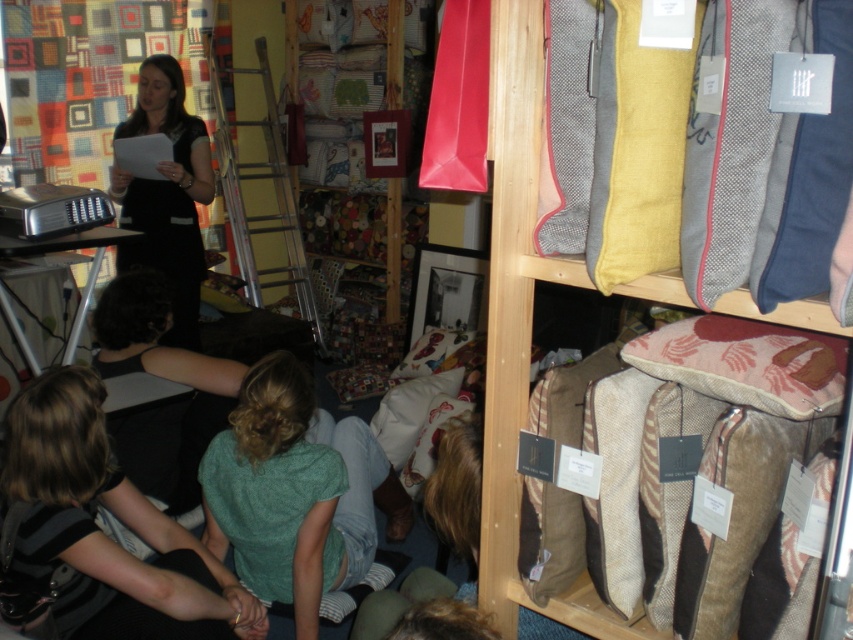
You are organizing a small exhibition and need to decide which item to place on a shelf that can only accommodate one of the two items. Given the green cotton shirt at lower center and the pink fabric pillow at lower right, which item would you choose based on their sizes?

The green cotton shirt at lower center has a larger size compared to the pink fabric pillow at lower right, so you should choose the green cotton shirt at lower center to place on the shelf since it requires more space.

You are organizing a small exhibition and need to decide which item to place in a display case that can only accommodate items taking up minimal space. Based on the scene, which item between the textured woolen cushion at upper right and the green cotton shirt at lower center should you choose?

The textured woolen cushion at upper right should be chosen because it occupies less space than the green cotton shirt at lower center, making it suitable for the display case with limited space.

You are a customer at the craft fair and want to approach the vendor. Which object, the blonde hair at lower left or the green cotton shirt at lower center, is narrower so you can navigate around them more easily?

The blonde hair at lower left has a lesser width compared to the green cotton shirt at lower center, so it is narrower and easier to navigate around.